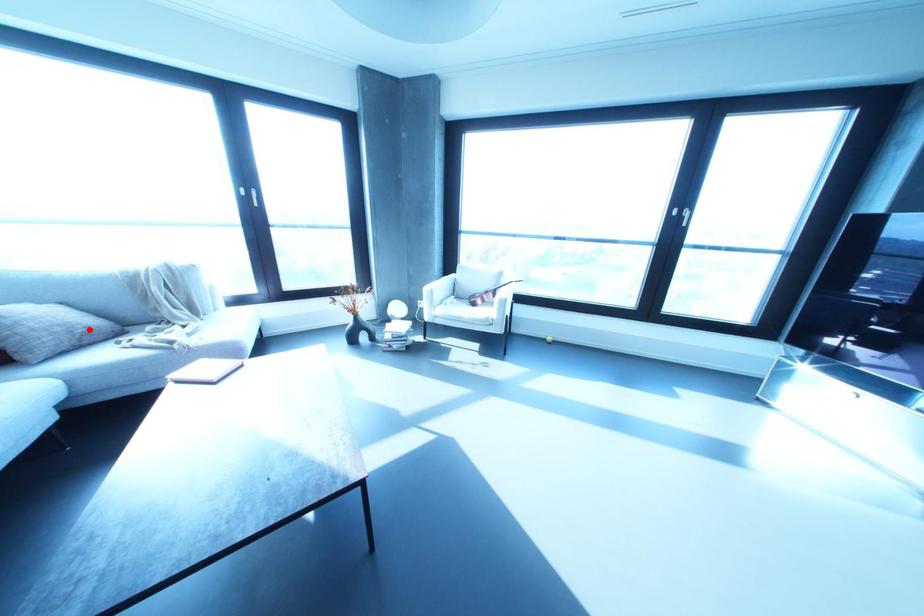
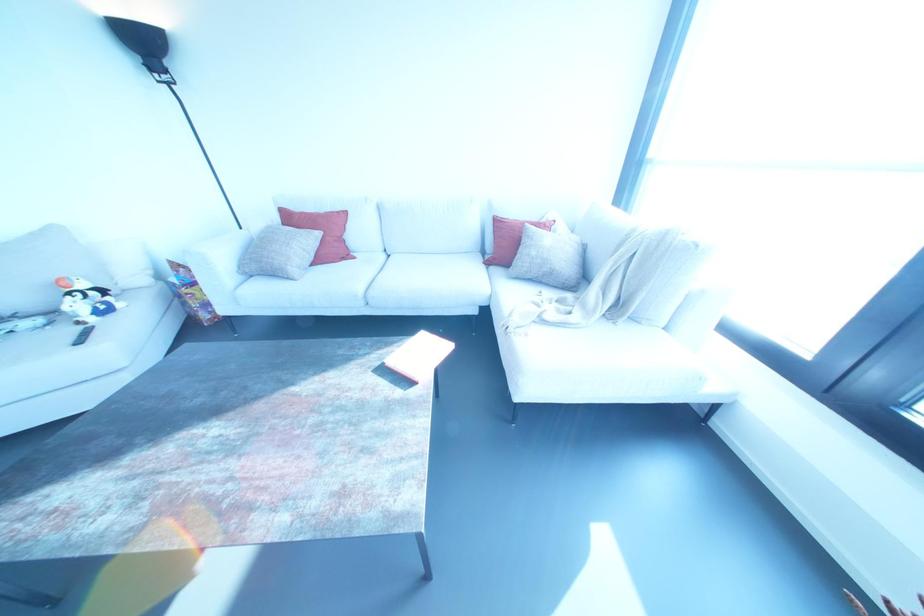
Question: I am providing you with two images of the same scene from different viewpoints. A red point is shown in image1. For the corresponding object point in image2, is it positioned nearer or farther from the camera?

Choices:
 (A) Nearer
 (B) Farther

Answer: (A)